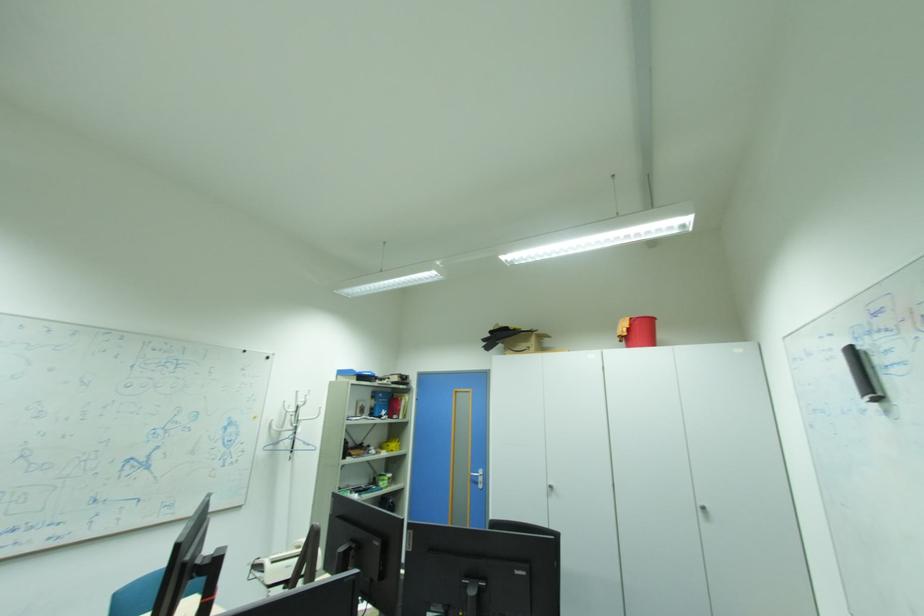
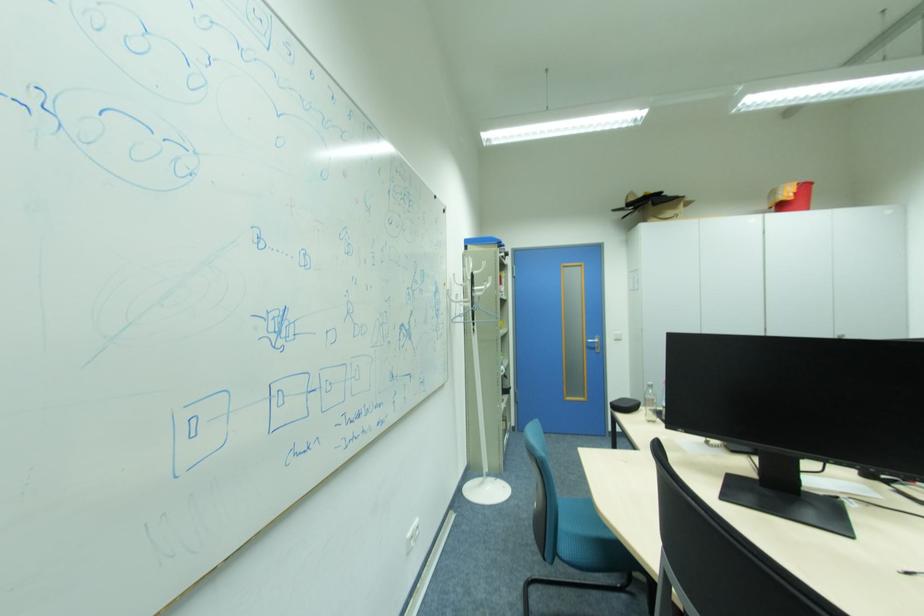
Question: Which direction would the cameraman need to move to produce the second image? Reply with the corresponding letter.

Choices:
 (A) Left
 (B) Right
 (C) Forward
 (D) Backward

Answer: (A)